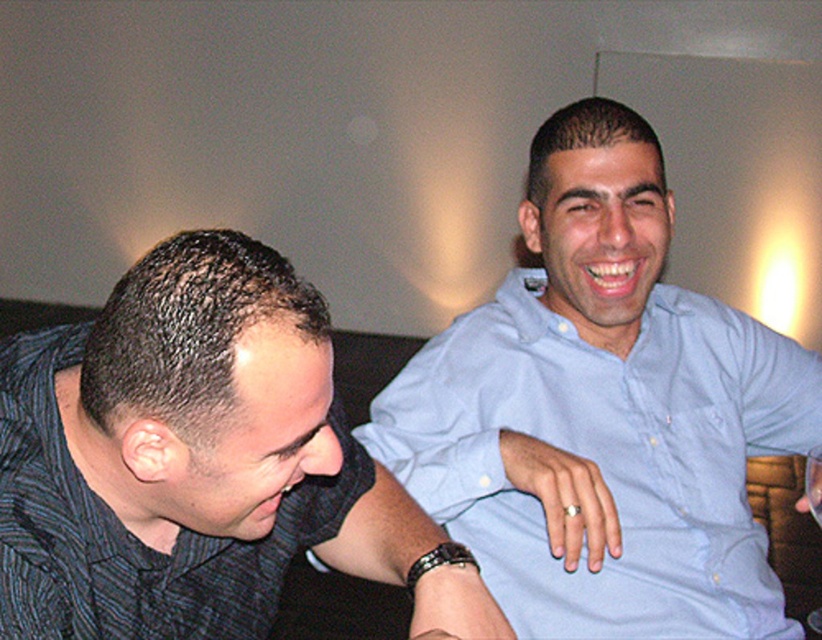
You are a photographer trying to capture a closeup of the transparent glass at upper left without including the light blue cotton shirt at right in the frame. Given their sizes, is this possible?

The light blue cotton shirt at right has a larger size compared to transparent glass at upper left, so it might be challenging to frame the transparent glass at upper left without including the light blue cotton shirt at right due to its larger size.

You are standing in front of the two people in the image. Which of the two points, point (411, 449) or point (820, 524), is closer to you?

Point (411, 449) is closer to you because it is further to the viewer than point (820, 524).